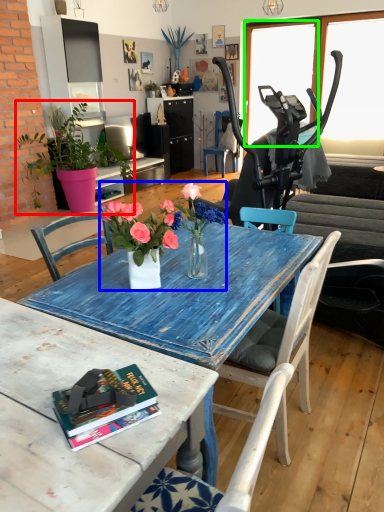
Question: Based on their relative distances, which object is farther from houseplant (highlighted by a red box)? Choose from floral arrangement (highlighted by a blue box) and window screen (highlighted by a green box).

Choices:
 (A) floral arrangement
 (B) window screen

Answer: (A)